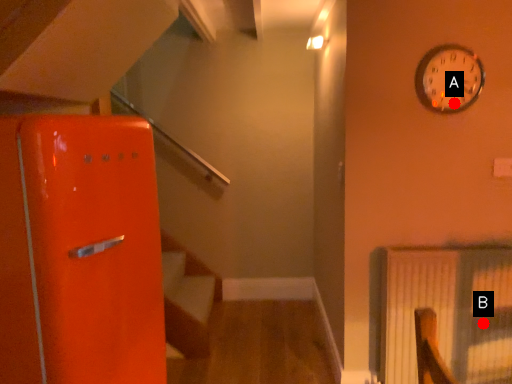
Question: Two points are circled on the image, labeled by A and B beside each circle. Which point is closer to the camera?

Choices:
 (A) A is closer
 (B) B is closer

Answer: (A)